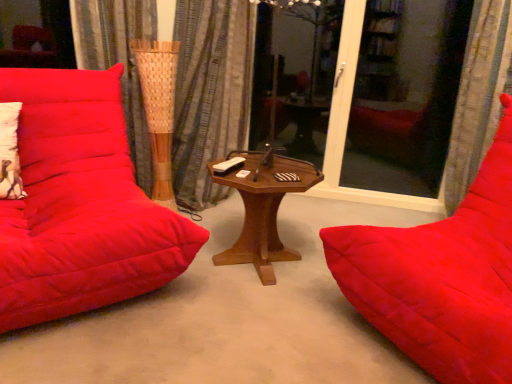
The width and height of the screenshot is (512, 384). I want to click on vacant region to the left of velvet red studio couch at right, the second studio couch positioned from the left, so click(271, 325).